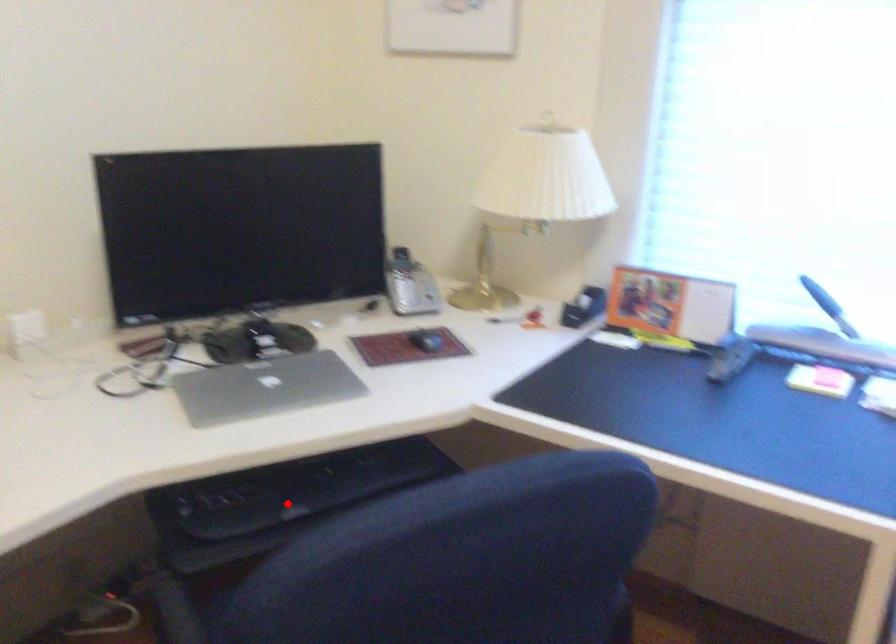
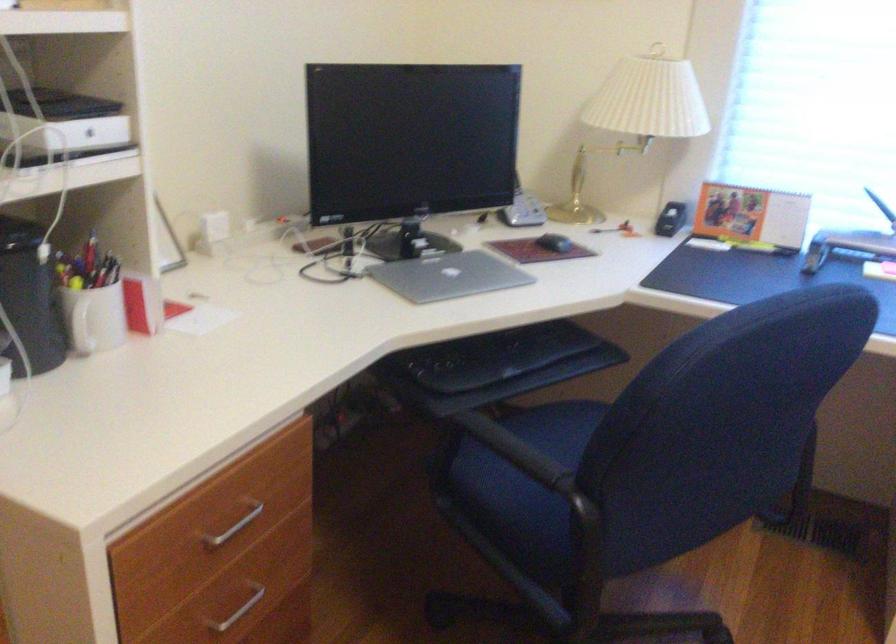
Question: A red point is marked in image1. In image2, is the corresponding 3D point closer to the camera or farther? Reply with the corresponding letter.

Choices:
 (A) The corresponding 3D point is closer.
 (B) The corresponding 3D point is farther.

Answer: (B)